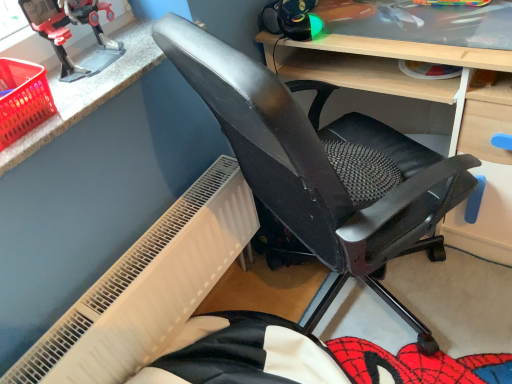
Locate an element on the screen. vacant space behind metallic plastic toy robot at upper left is located at coordinates (118, 41).